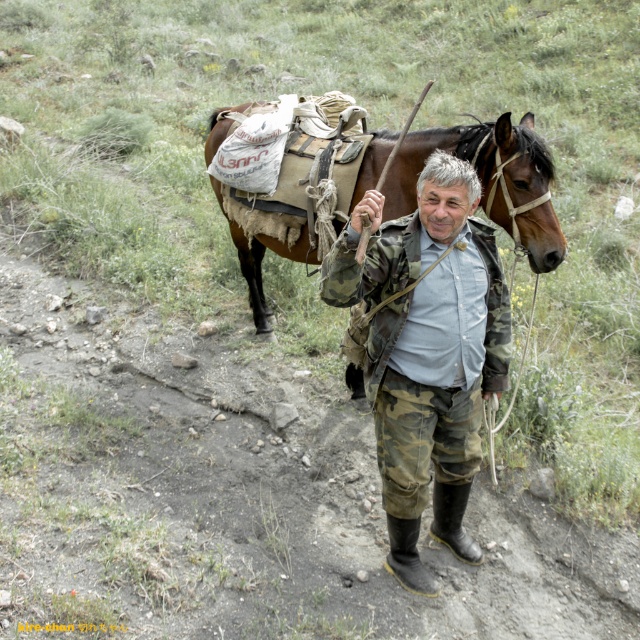
Question: Which point is farther to the camera?

Choices:
 (A) (508, 218)
 (B) (408, 563)
 (C) (458, 502)
 (D) (388, 516)

Answer: (A)

Question: Which point is farther to the camera?

Choices:
 (A) rubber/matte boot at lower center
 (B) rubber/mesh boot at lower center
 (C) camouflage fabric jacket at center
 (D) brown leather saddle at upper center

Answer: (B)

Question: Does camouflage fabric jacket at center lie in front of rubber/matte boot at lower center?

Choices:
 (A) yes
 (B) no

Answer: (A)

Question: Is brown leather saddle at upper center to the left of rubber/matte boot at lower center from the viewer's perspective?

Choices:
 (A) no
 (B) yes

Answer: (B)

Question: Where is brown leather saddle at upper center located in relation to rubber/mesh boot at lower center in the image?

Choices:
 (A) left
 (B) right

Answer: (A)

Question: Which point is closer to the camera?

Choices:
 (A) (477, 392)
 (B) (397, 518)

Answer: (A)